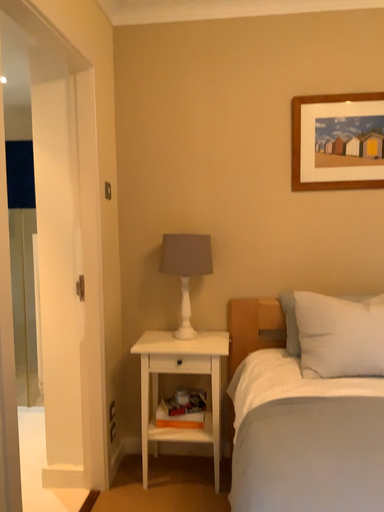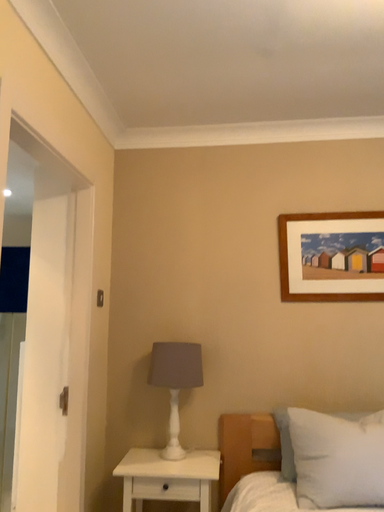
Question: Which way did the camera rotate in the video?

Choices:
 (A) rotated upward
 (B) rotated downward

Answer: (A)